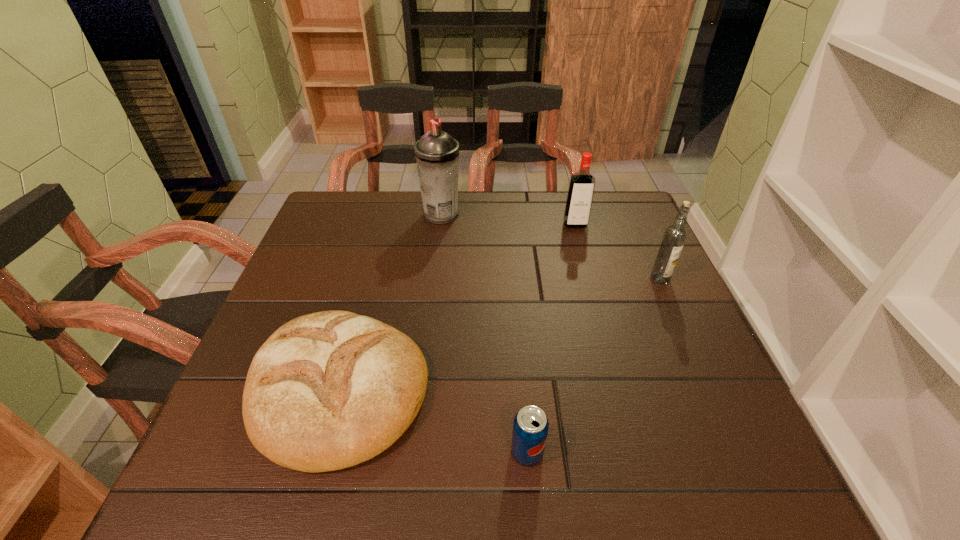
Image resolution: width=960 pixels, height=540 pixels. Find the location of `free point at the near edge`. free point at the near edge is located at coordinates (661, 483).

Where is `vacant space at the right edge of the desktop`? The image size is (960, 540). vacant space at the right edge of the desktop is located at coordinates (683, 437).

In the image, there is a desktop. Where is `free space at the far left corner`? The width and height of the screenshot is (960, 540). free space at the far left corner is located at coordinates [330, 215].

In the image, there is a desktop. Identify the location of vacant space at the far right corner. Image resolution: width=960 pixels, height=540 pixels. coord(609,205).

This screenshot has height=540, width=960. In order to click on vacant region at the near right corner of the desktop in this screenshot , I will do `click(708, 474)`.

At what (x,y) coordinates should I click in order to perform the action: click on empty space between the bread and the third object from right to left. Please return your answer as a coordinate pair (x, y). The width and height of the screenshot is (960, 540). Looking at the image, I should click on (433, 420).

At what (x,y) coordinates should I click in order to perform the action: click on vacant point located between the aerosol can and the bread. Please return your answer as a coordinate pair (x, y). The width and height of the screenshot is (960, 540). Looking at the image, I should click on (391, 301).

Locate an element on the screen. The image size is (960, 540). free space between the rightmost object and the pop soda is located at coordinates (593, 365).

The width and height of the screenshot is (960, 540). I want to click on unoccupied area between the bread and the pop soda, so click(x=433, y=420).

This screenshot has width=960, height=540. I want to click on free space between the bread and the rightmost object, so click(499, 334).